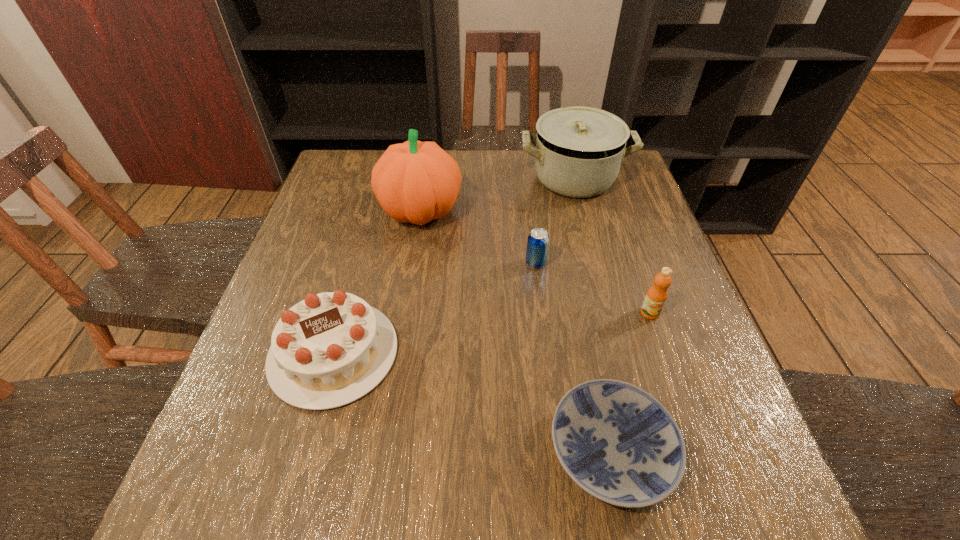
At what (x,y) coordinates should I click in order to perform the action: click on pumpkin. Please return your answer as a coordinate pair (x, y). The width and height of the screenshot is (960, 540). Looking at the image, I should click on (416, 182).

Locate an element on the screen. the fifth shortest object is located at coordinates (578, 151).

At what (x,y) coordinates should I click in order to perform the action: click on orange juice. Please return your answer as a coordinate pair (x, y). This screenshot has width=960, height=540. Looking at the image, I should click on (656, 296).

Identify the location of the third shortest object. This screenshot has width=960, height=540. (332, 348).

Where is `the third farthest object`? the third farthest object is located at coordinates (538, 240).

Where is `beer can`? This screenshot has width=960, height=540. beer can is located at coordinates (538, 240).

Find the location of a particular element. Image resolution: width=960 pixels, height=540 pixels. plate is located at coordinates (618, 443).

Identify the location of free space located on the right of the tallest object. The image size is (960, 540). (515, 211).

Locate an element on the screen. The image size is (960, 540). free space located 0.110m on the left of the saucepan is located at coordinates (482, 178).

Locate an element on the screen. This screenshot has width=960, height=540. free region located 0.350m on the front label of the orange juice is located at coordinates (712, 494).